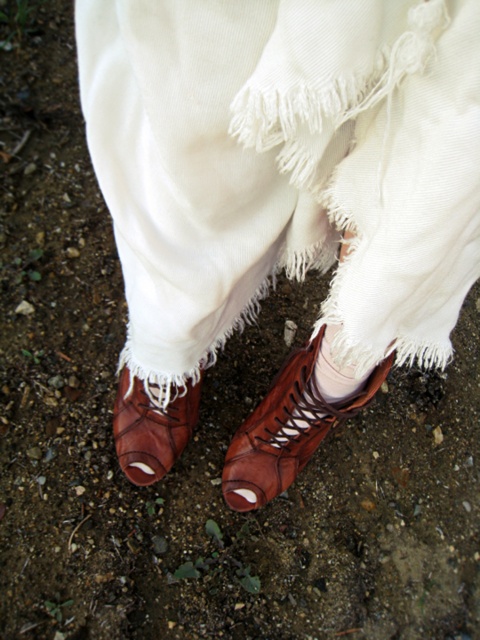
You are trying to decide which boot to wear first. The leather boot at lower center and the brown leather boot at center are both in your view. Which one is located to the left of the other?

The leather boot at lower center is positioned on the left side of brown leather boot at center.

You are standing 5 feet away from the brown leather boot at center. Can you reach it without moving your feet?

The brown leather boot at center is 36.15 inches from viewer. Since 5 feet equals 60 inches, the boot is closer than 5 feet, so you can reach it without moving your feet.

You are trying to decide which boot to wear based on the image. The scene shows two brown leather boots. The first is labeled as the leather boot at lower center, and the second is the brown leather boot at center. Which of these two boots is taller?

The leather boot at lower center is taller than the brown leather boot at center according to the description.